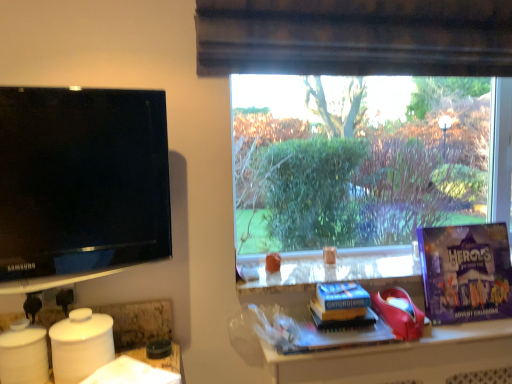
Question: From a real-world perspective, is hardcover book at center, marked as the first book in a bottom-to-top arrangement, positioned under blue paper at center, which ranks as the 2th paperback book in top-to-bottom order, based on gravity?

Choices:
 (A) no
 (B) yes

Answer: (B)

Question: Can you confirm if hardcover book at center, marked as the first book in a bottom-to-top arrangement, is smaller than blue paper at center, placed as the 2th paperback book when sorted from right to left?

Choices:
 (A) no
 (B) yes

Answer: (A)

Question: Is hardcover book at center, marked as the first book in a bottom-to-top arrangement, facing towards blue paper at center, the 1th paperback book from the left?

Choices:
 (A) no
 (B) yes

Answer: (A)

Question: Is hardcover book at center, acting as the second book starting from the top, not inside blue paper at center, placed as the 2th paperback book when sorted from right to left?

Choices:
 (A) yes
 (B) no

Answer: (A)

Question: Does hardcover book at center, marked as the first book in a bottom-to-top arrangement, touch blue paper at center, which ranks as the 2th paperback book in top-to-bottom order?

Choices:
 (A) no
 (B) yes

Answer: (B)

Question: Considering the positions of matte black tv at left and blue paper at center, the 1th paperback book from the left, in the image, is matte black tv at left bigger or smaller than blue paper at center, the 1th paperback book from the left,?

Choices:
 (A) small
 (B) big

Answer: (B)

Question: Is matte black tv at left in front of or behind blue paper at center, which ranks as the 2th paperback book in top-to-bottom order, in the image?

Choices:
 (A) front
 (B) behind

Answer: (A)

Question: Considering the positions of matte black tv at left and blue paper at center, which ranks as the 2th paperback book in top-to-bottom order, in the image, is matte black tv at left taller or shorter than blue paper at center, which ranks as the 2th paperback book in top-to-bottom order,?

Choices:
 (A) short
 (B) tall

Answer: (B)

Question: Is matte black tv at left wider or thinner than blue paper at center, placed as the 2th paperback book when sorted from right to left?

Choices:
 (A) wide
 (B) thin

Answer: (B)

Question: From a real-world perspective, is yellow matte book at center, marked as the second book in a bottom-to-top arrangement, positioned above or below blue paper at center, placed as the 2th paperback book when sorted from right to left?

Choices:
 (A) below
 (B) above

Answer: (A)

Question: Is yellow matte book at center, marked as the second book in a bottom-to-top arrangement, taller or shorter than blue paper at center, which is the 1th paperback book from bottom to top?

Choices:
 (A) tall
 (B) short

Answer: (A)

Question: From the image's perspective, relative to blue paper at center, which ranks as the 2th paperback book in top-to-bottom order, is yellow matte book at center, the first book in the top-to-bottom sequence, above or below?

Choices:
 (A) below
 (B) above

Answer: (A)

Question: In terms of size, does yellow matte book at center, the first book in the top-to-bottom sequence, appear bigger or smaller than blue paper at center, which ranks as the 2th paperback book in top-to-bottom order?

Choices:
 (A) small
 (B) big

Answer: (B)

Question: Considering the positions of hardcover book at center, marked as the first book in a bottom-to-top arrangement, and purple cardboard advent calendar at right, which is counted as the first paperback book, starting from the top, in the image, is hardcover book at center, marked as the first book in a bottom-to-top arrangement, bigger or smaller than purple cardboard advent calendar at right, which is counted as the first paperback book, starting from the top,?

Choices:
 (A) small
 (B) big

Answer: (A)

Question: From a real-world perspective, is hardcover book at center, acting as the second book starting from the top, above or below purple cardboard advent calendar at right, which is the second paperback book from left to right?

Choices:
 (A) above
 (B) below

Answer: (B)